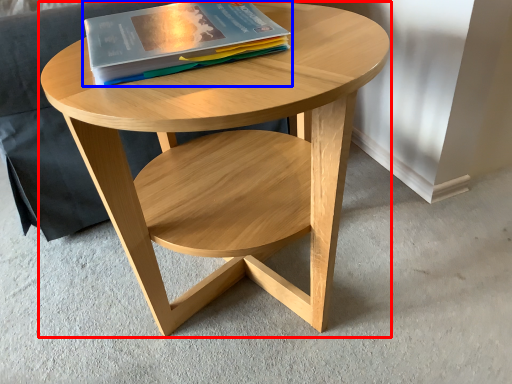
Question: Which object appears farthest to the camera in this image, coffee table (highlighted by a red box) or book (highlighted by a blue box)?

Choices:
 (A) coffee table
 (B) book

Answer: (B)